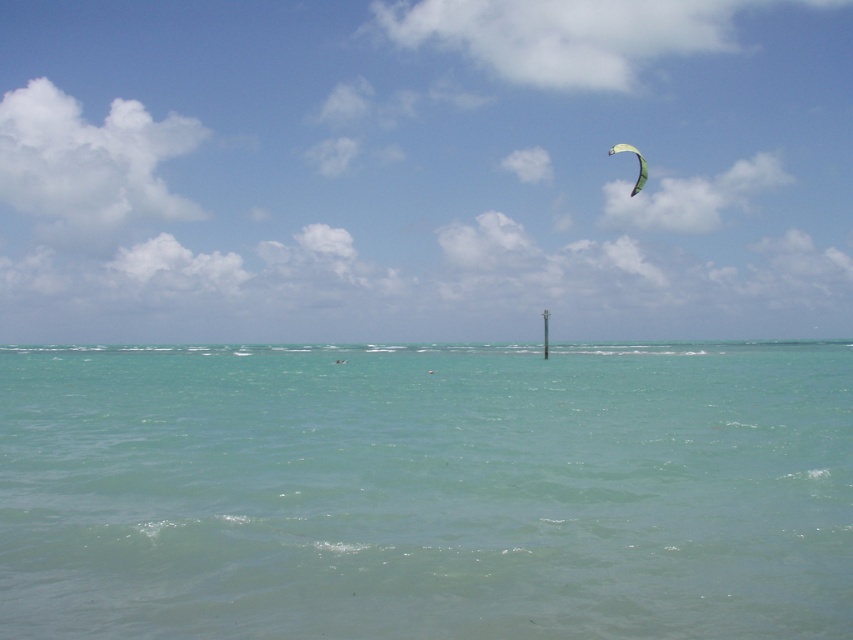
Is point (839, 116) more distant than point (634, 184)?

Yes, it is behind point (634, 184).

Between transparent kite at upper center and green fabric parachute at upper right, which one has more height?

transparent kite at upper center

Which is behind, point (20, 154) or point (635, 150)?

The point (20, 154) is behind.

Find the location of `transparent kite at upper center`. transparent kite at upper center is located at coordinates (422, 170).

Can you confirm if transparent kite at upper center is positioned to the left of clear blue water at center?

No, transparent kite at upper center is not to the left of clear blue water at center.

Does transparent kite at upper center have a greater height compared to clear blue water at center?

Indeed, transparent kite at upper center has a greater height compared to clear blue water at center.

Is point (209, 136) farther from camera compared to point (541, 593)?

Yes, point (209, 136) is behind point (541, 593).

Where is `transparent kite at upper center`? The image size is (853, 640). transparent kite at upper center is located at coordinates (422, 170).

Is clear blue water at center bigger than green fabric parachute at upper right?

Actually, clear blue water at center might be smaller than green fabric parachute at upper right.

Who is shorter, clear blue water at center or green fabric parachute at upper right?

With less height is clear blue water at center.

Where is `clear blue water at center`? The height and width of the screenshot is (640, 853). clear blue water at center is located at coordinates (426, 492).

This screenshot has height=640, width=853. Find the location of `clear blue water at center`. clear blue water at center is located at coordinates (426, 492).